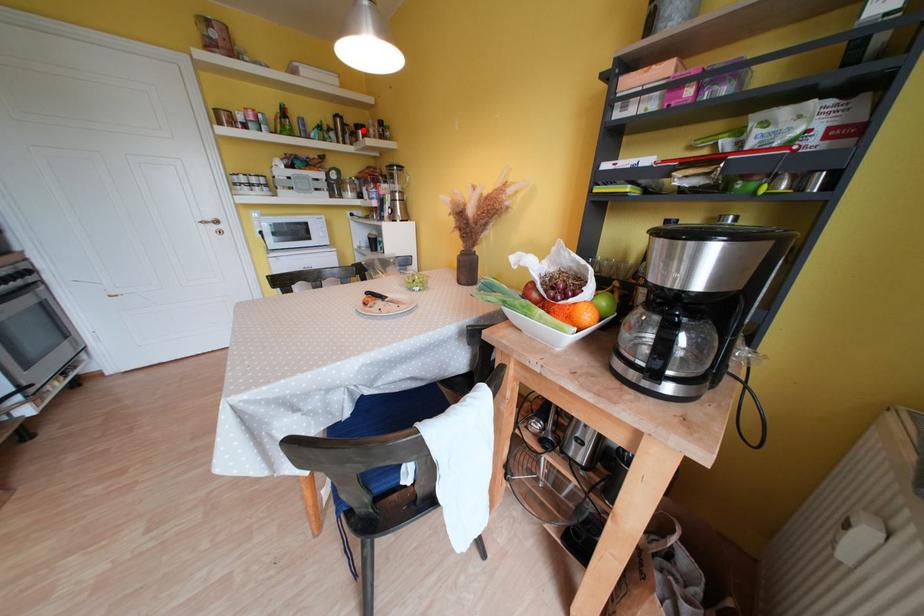
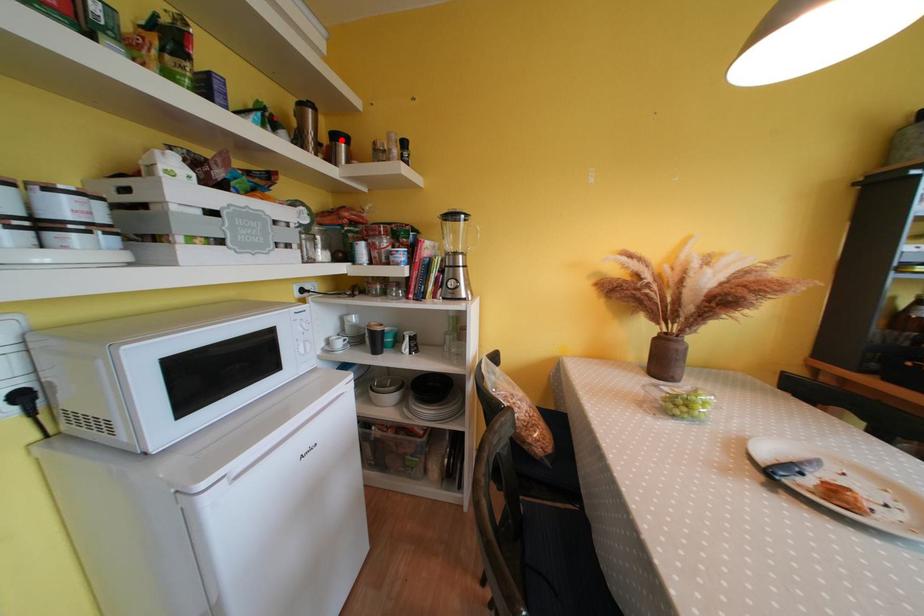
I am providing you with two images of the same scene from different viewpoints. A red point is marked on the first image and another point is marked on the second image. Is the red point in image1 aligned with the point shown in image2?

Yes